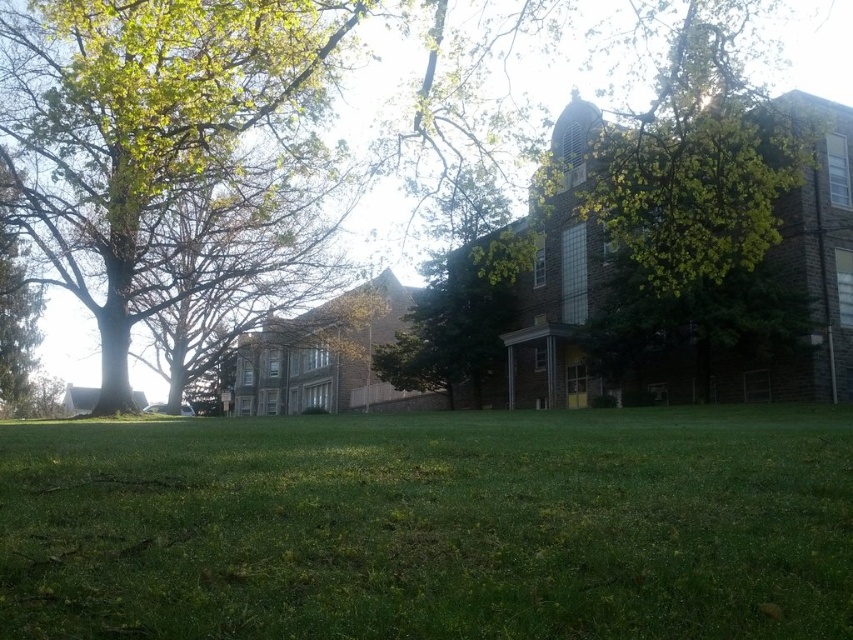
Is the position of green grass at lower center less distant than that of green leafy tree at upper center?

Yes.

Describe the element at coordinates (431, 525) in the screenshot. I see `green grass at lower center` at that location.

Between point (149, 564) and point (357, 81), which one is positioned behind?

Positioned behind is point (357, 81).

The image size is (853, 640). In order to click on green grass at lower center in this screenshot , I will do `click(431, 525)`.

From the picture: Which is above, green grass at lower center or green leafy tree at upper left?

green leafy tree at upper left

Is green grass at lower center in front of green leafy tree at upper left?

That is True.

This screenshot has height=640, width=853. Find the location of `green grass at lower center`. green grass at lower center is located at coordinates (431, 525).

Where is `green grass at lower center`? This screenshot has width=853, height=640. green grass at lower center is located at coordinates (431, 525).

Does green leafy tree at upper left have a larger size compared to green leafy tree at upper center?

No.

Does green leafy tree at upper left appear on the left side of green leafy tree at upper center?

No, green leafy tree at upper left is not to the left of green leafy tree at upper center.

Does point (167, 38) come in front of point (368, 54)?

Yes.

You are a GUI agent. You are given a task and a screenshot of the screen. Output one action in this format:
    pyautogui.click(x=<x>, y=<y>)
    Task: Click on the green leafy tree at upper left
    This screenshot has height=640, width=853.
    Given the screenshot: What is the action you would take?
    pyautogui.click(x=149, y=141)